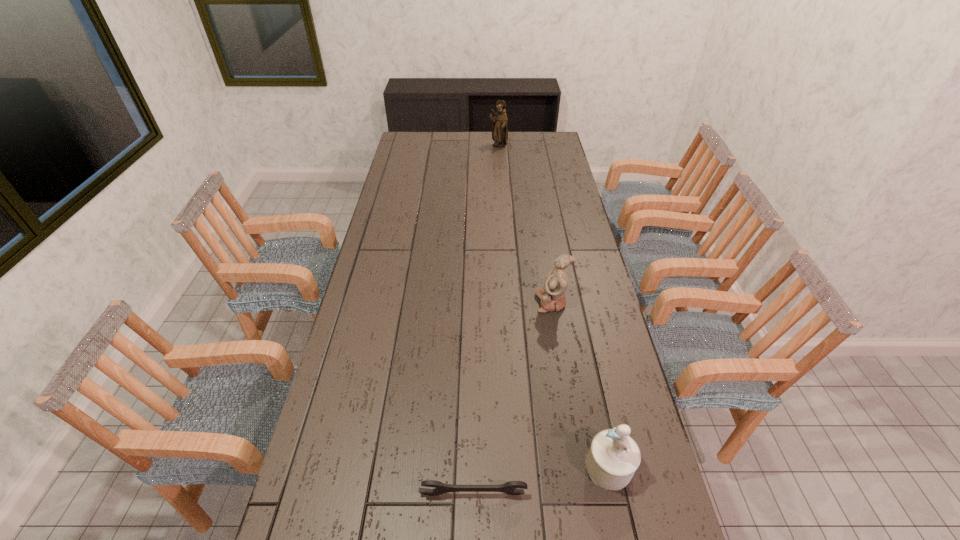
This screenshot has width=960, height=540. Find the location of `vacant space that's between the second nearest figurine and the leftmost figurine`. vacant space that's between the second nearest figurine and the leftmost figurine is located at coordinates (525, 224).

Where is `free space that is in between the farthest object and the second farthest object`? The image size is (960, 540). free space that is in between the farthest object and the second farthest object is located at coordinates tap(525, 224).

The width and height of the screenshot is (960, 540). I want to click on empty location between the second nearest object and the wrench, so click(x=541, y=480).

What are the coordinates of `free area in between the second nearest object and the shortest object` in the screenshot? It's located at tap(541, 480).

Where is `empty space between the nearest object and the farthest figurine`? Image resolution: width=960 pixels, height=540 pixels. empty space between the nearest object and the farthest figurine is located at coordinates (486, 320).

Find the location of a particular element. This screenshot has height=540, width=960. unoccupied area between the second farthest object and the nearest figurine is located at coordinates (581, 384).

Locate an element on the screen. free spot between the nearest figurine and the nearest object is located at coordinates (541, 480).

Where is `free space that is in between the second farthest object and the nearest figurine`? free space that is in between the second farthest object and the nearest figurine is located at coordinates (581, 384).

Point out which object is positioned as the nearest to the second farthest figurine. Please provide its 2D coordinates. Your answer should be formatted as a tuple, i.e. [(x, y)], where the tuple contains the x and y coordinates of a point satisfying the conditions above.

[(613, 458)]

You are a GUI agent. You are given a task and a screenshot of the screen. Output one action in this format:
    pyautogui.click(x=<x>, y=<y>)
    Task: Click on the object that can be found as the closest to the nearest figurine
    
    Given the screenshot: What is the action you would take?
    pyautogui.click(x=510, y=487)